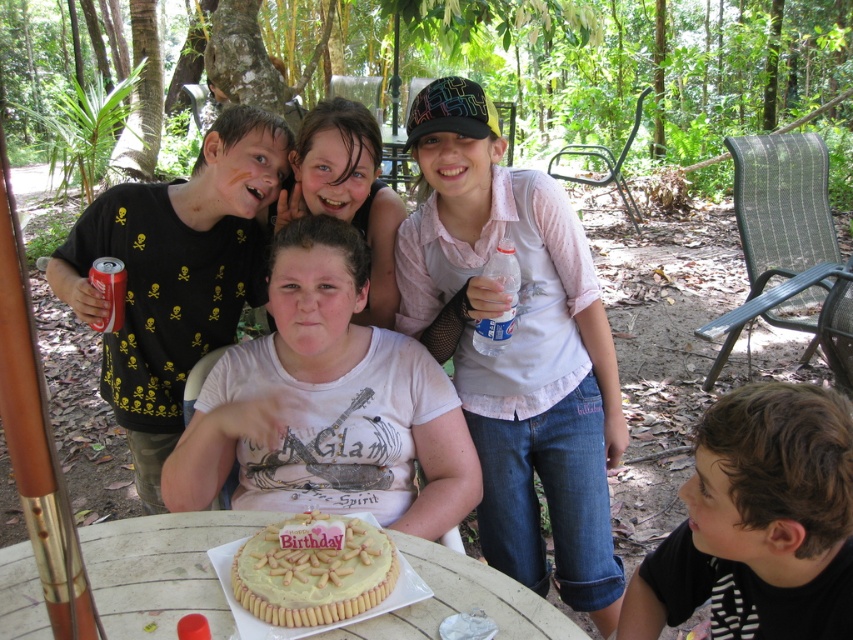
You are a guest at the birthday celebration and notice the white matte shirt at center and the yellow frosted cake at center. Which object is positioned higher in the scene?

The white matte shirt at center is above the yellow frosted cake at center, so it is positioned higher in the scene.

You are a guest at the birthday celebration and want to reach both the matte white cake at center and the yellow frosted cake at center. If you can only move forward in a straight line, which cake will you reach first?

The matte white cake at center will be reached first because it is closer to you than the yellow frosted cake at center.